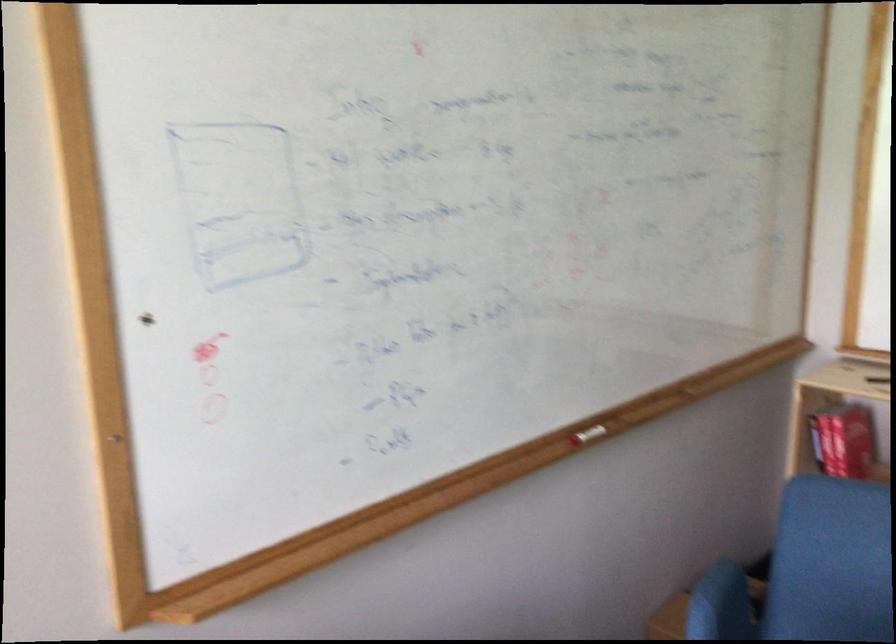
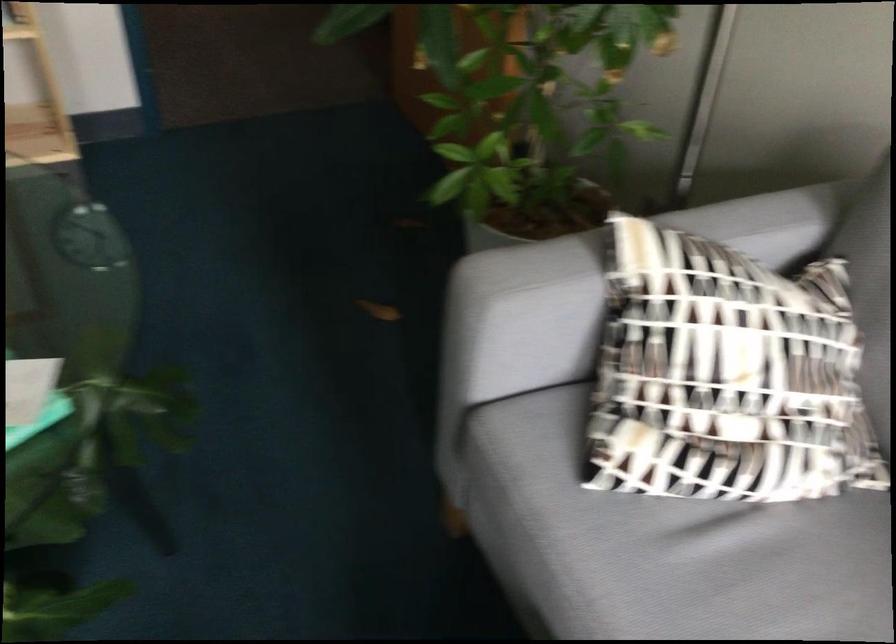
First-person continuous shooting, in which direction is the camera rotating?

The rotation direction of the camera is right-down.